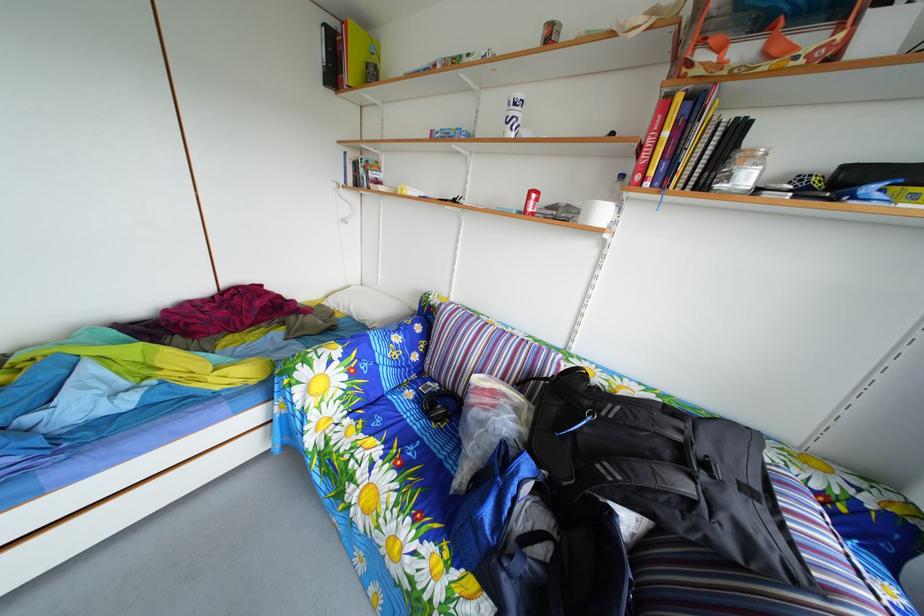
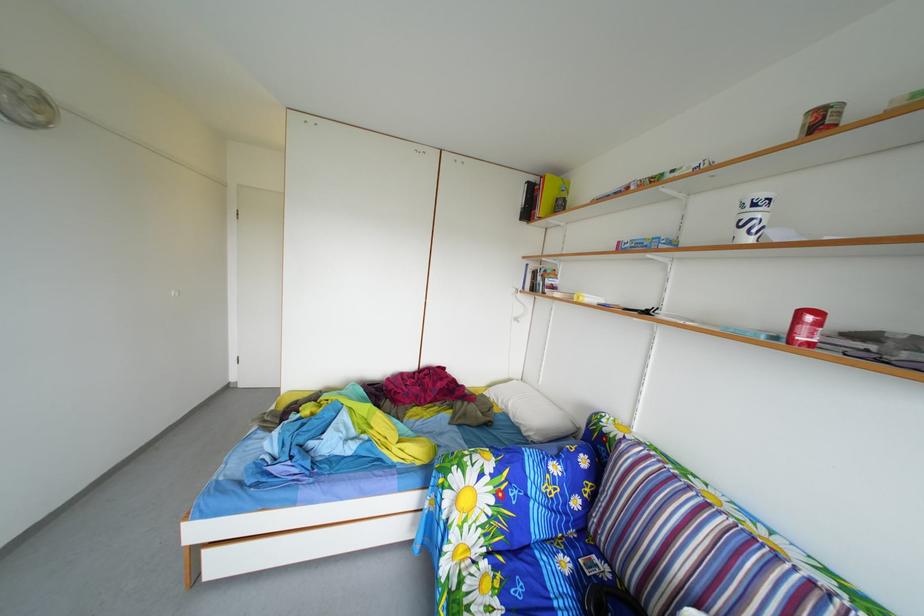
The point at (x=541, y=200) is marked in the first image. Where is the corresponding point in the second image?

(811, 321)